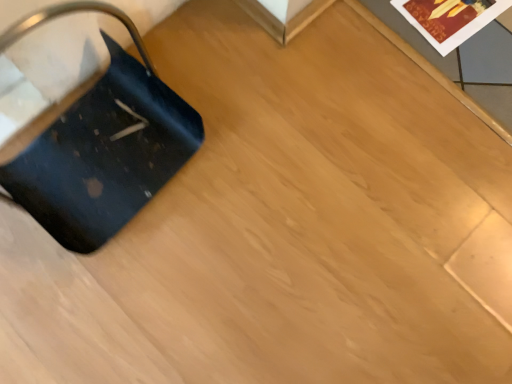
Question: From the image's perspective, is matte paper postcard at upper right located above or below matte black suitcase at left?

Choices:
 (A) below
 (B) above

Answer: (B)

Question: From their relative heights in the image, would you say matte paper postcard at upper right is taller or shorter than matte black suitcase at left?

Choices:
 (A) short
 (B) tall

Answer: (A)

Question: Is matte paper postcard at upper right inside or outside of matte black suitcase at left?

Choices:
 (A) inside
 (B) outside

Answer: (B)

Question: Is matte black suitcase at left taller or shorter than matte paper postcard at upper right?

Choices:
 (A) tall
 (B) short

Answer: (A)

Question: Is matte black suitcase at left in front of or behind matte paper postcard at upper right in the image?

Choices:
 (A) behind
 (B) front

Answer: (B)

Question: In the image, is matte black suitcase at left on the left side or the right side of matte paper postcard at upper right?

Choices:
 (A) right
 (B) left

Answer: (B)

Question: Is matte black suitcase at left situated inside matte paper postcard at upper right or outside?

Choices:
 (A) inside
 (B) outside

Answer: (B)